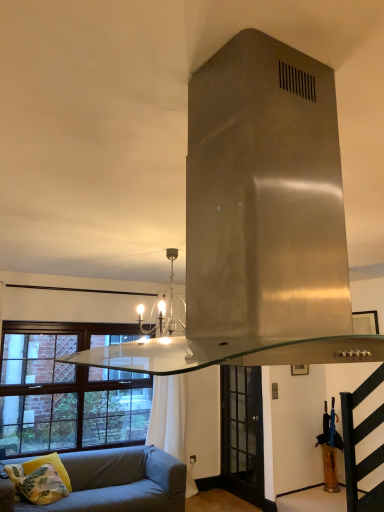
You are a GUI agent. You are given a task and a screenshot of the screen. Output one action in this format:
    pyautogui.click(x=<x>, y=<y>)
    Task: Click on the free point above yellow floral pillow at lower left, marked as the second pillow in a right-to-left arrangement (from a real-world perspective)
    
    Given the screenshot: What is the action you would take?
    pyautogui.click(x=31, y=460)